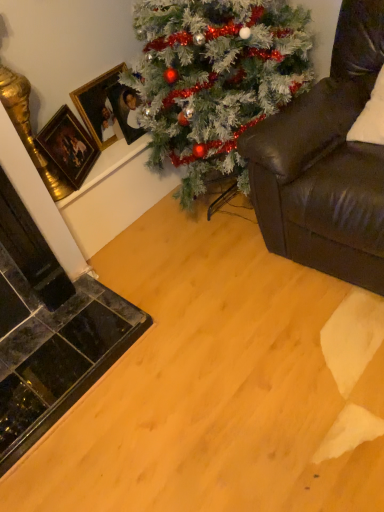
Question: In terms of width, does green matte christmas tree at upper center look wider or thinner when compared to gold-framed picture at upper left, which appears as the first picture frame when viewed from the right?

Choices:
 (A) thin
 (B) wide

Answer: (B)

Question: Based on their positions, is green matte christmas tree at upper center located to the left or right of gold-framed picture at upper left, which appears as the first picture frame when viewed from the right?

Choices:
 (A) left
 (B) right

Answer: (B)

Question: Considering the real-world distances, which object is closest to the gold-framed picture at upper left, which appears as the first picture frame when viewed from the right?

Choices:
 (A) leather couch at right
 (B) gold/gilded picture frame at upper left, which is counted as the 1th picture frame, starting from the left
 (C) gold-framed picture at upper left, the second picture frame positioned from the right
 (D) green matte christmas tree at upper center

Answer: (C)

Question: Estimate the real-world distances between objects in this image. Which object is farther from the gold-framed picture at upper left, which appears as the first picture frame when viewed from the right?

Choices:
 (A) gold-framed picture at upper left, which ranks as the 2th picture frame in left-to-right order
 (B) leather couch at right
 (C) gold/gilded picture frame at upper left, which is counted as the 1th picture frame, starting from the left
 (D) green matte christmas tree at upper center

Answer: (B)